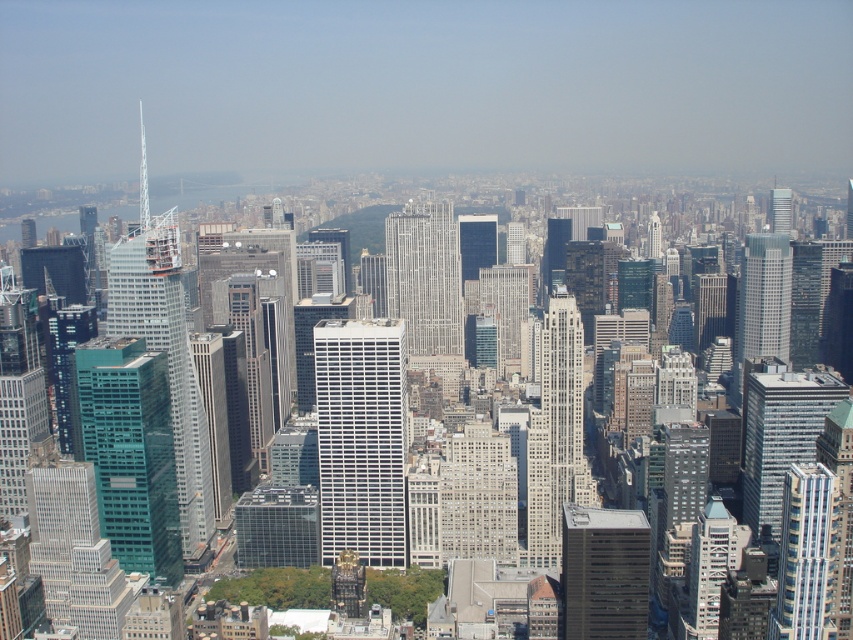
You are a city planner reviewing this urban layout. You need to determine the spatial relationship between the silver metallic skyscraper at center and the glassy reflective skyscraper at center. Which one is located to the left of the other?

The silver metallic skyscraper at center is positioned on the left side of glassy reflective skyscraper at center.

You are a city planner analyzing the urban layout. You need to determine which of the two central skyscrapers, the silver metallic skyscraper at center or the glassy reflective skyscraper at center, has a greater horizontal span. Based on the provided information, which one is wider?

The silver metallic skyscraper at center is wider than the glassy reflective skyscraper at center, as its width surpasses that of the glassy reflective skyscraper at center.

You are a drone operator who needs to deliver a package to the gray concrete skyscraper at lower right. The drone has a maximum flight range of 650 meters. Can the drone reach the skyscraper?

The gray concrete skyscraper at lower right is 654.68 meters from camera. The drone cannot reach it because its maximum flight range is 650 meters, which is shorter than the required distance.